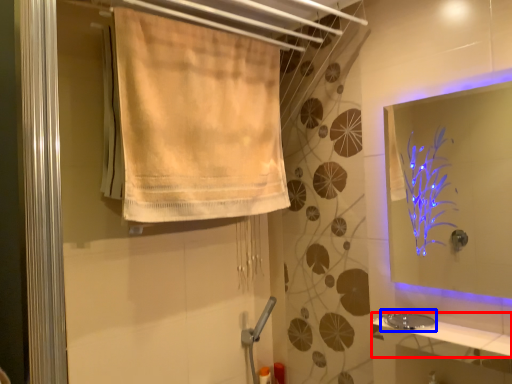
Question: Which point is closer to the camera, counter top (highlighted by a red box) or sink (highlighted by a blue box)?

Choices:
 (A) counter top
 (B) sink

Answer: (A)